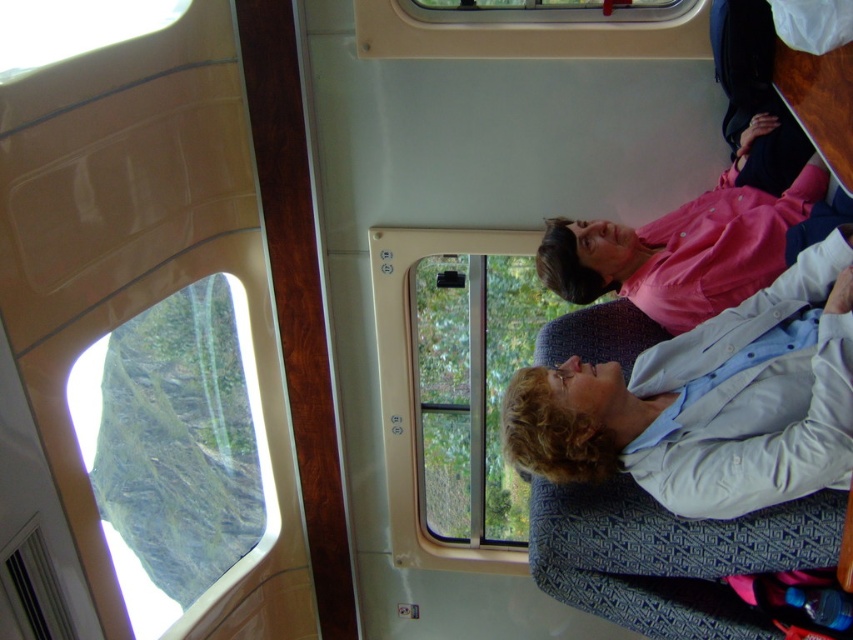
Question: Which point is closer to the camera?

Choices:
 (A) transparent glass window at lower left
 (B) pink matte shirt at upper right
 (C) transparent glass window at center

Answer: (B)

Question: Does transparent glass window at center have a greater width compared to transparent plastic window at upper center?

Choices:
 (A) no
 (B) yes

Answer: (A)

Question: Which object is closer to the camera taking this photo?

Choices:
 (A) transparent plastic window at upper center
 (B) light blue fabric shirt at center

Answer: (B)

Question: In this image, where is light blue fabric shirt at center located relative to transparent glass window at lower left?

Choices:
 (A) left
 (B) right

Answer: (B)

Question: Among these points, which one is farthest from the camera?

Choices:
 (A) 207,516
 (B) 636,3
 (C) 660,465
 (D) 821,221

Answer: (A)

Question: Does light blue fabric shirt at center appear on the left side of transparent plastic window at upper center?

Choices:
 (A) yes
 (B) no

Answer: (B)